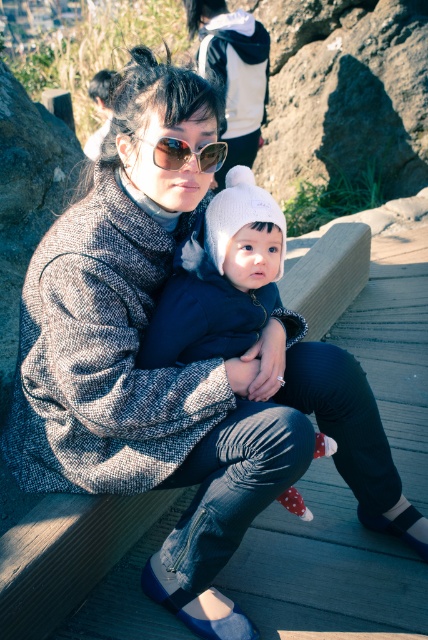
Is white knit hat at center further to the viewer compared to sunglasses at center?

Yes, white knit hat at center is further from the viewer.

Between white knit hat at center and sunglasses at center, which one is positioned lower?

white knit hat at center is lower down.

This screenshot has height=640, width=428. What do you see at coordinates (219, 278) in the screenshot?
I see `white knit hat at center` at bounding box center [219, 278].

This screenshot has width=428, height=640. I want to click on white knit hat at center, so click(219, 278).